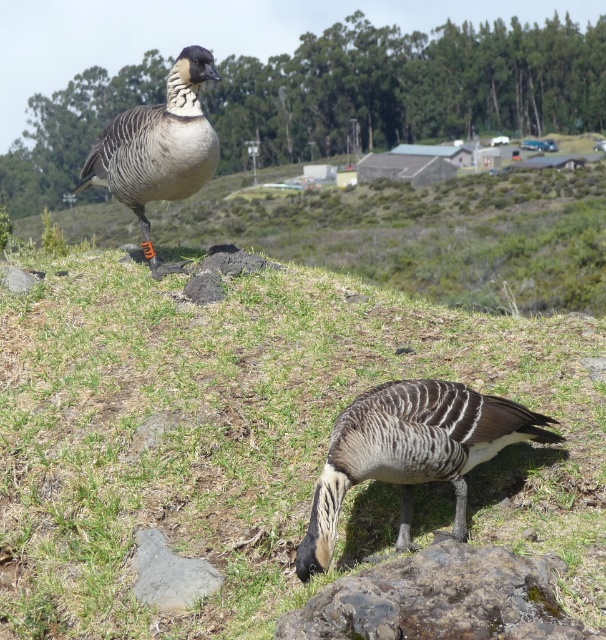
Question: Is gray-feathered goose at lower center closer to the viewer compared to brown feathered goose at upper left?

Choices:
 (A) no
 (B) yes

Answer: (B)

Question: Which point is farther to the camera?

Choices:
 (A) (105, 173)
 (B) (144, 513)

Answer: (A)

Question: Which object is closer to the camera taking this photo?

Choices:
 (A) brown feathered goose at upper left
 (B) green grass at upper center
 (C) gray-feathered goose at lower center

Answer: (B)

Question: Is gray-feathered goose at lower center behind brown feathered goose at upper left?

Choices:
 (A) yes
 (B) no

Answer: (B)

Question: Is the position of green grass at upper center less distant than that of gray-feathered goose at lower center?

Choices:
 (A) yes
 (B) no

Answer: (A)

Question: Which of the following is the closest to the observer?

Choices:
 (A) (187, 173)
 (B) (508, 502)

Answer: (B)